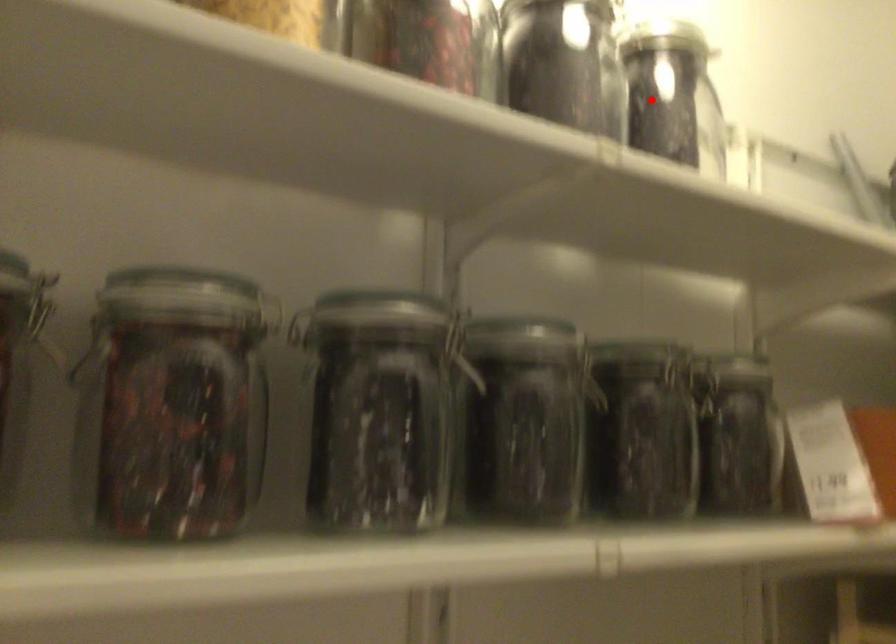
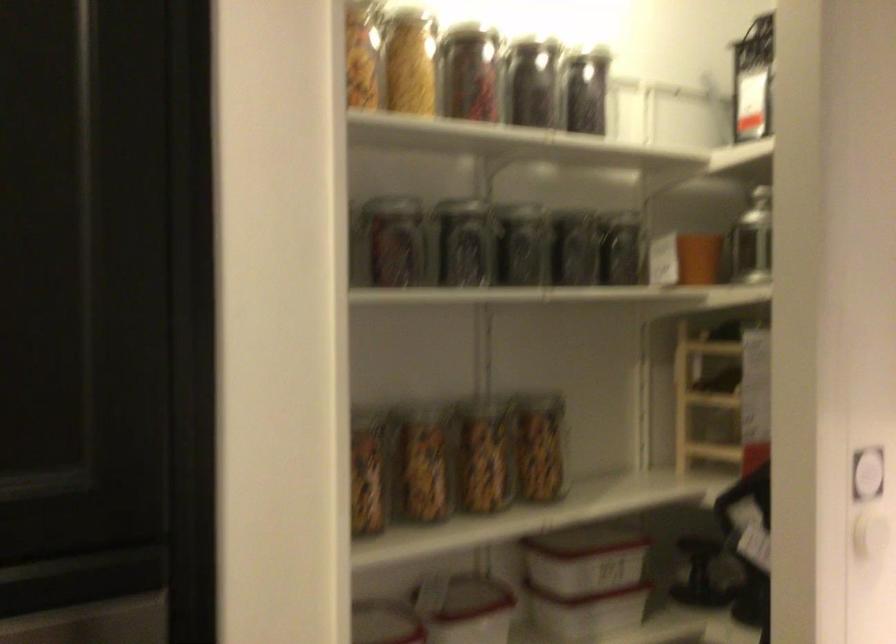
Locate, in the second image, the point that corresponds to the highlighted location in the first image.

(586, 90)